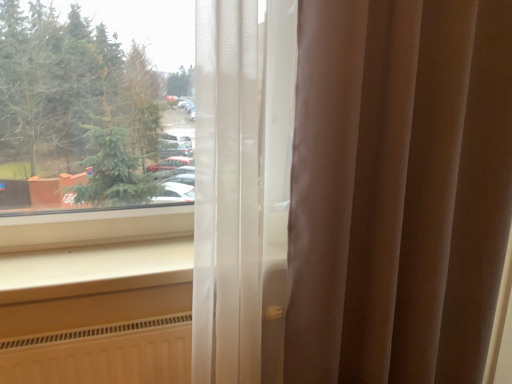
Question: Considering the positions of sheer white curtain at center and white smooth window sill at lower left in the image, is sheer white curtain at center taller or shorter than white smooth window sill at lower left?

Choices:
 (A) short
 (B) tall

Answer: (B)

Question: From the image's perspective, is sheer white curtain at center positioned above or below white smooth window sill at lower left?

Choices:
 (A) below
 (B) above

Answer: (B)

Question: Do you think sheer white curtain at center is within white smooth window sill at lower left, or outside of it?

Choices:
 (A) inside
 (B) outside

Answer: (B)

Question: In terms of width, does white smooth window sill at lower left look wider or thinner when compared to sheer white curtain at center?

Choices:
 (A) wide
 (B) thin

Answer: (A)

Question: Which is correct: white smooth window sill at lower left is inside sheer white curtain at center, or outside of it?

Choices:
 (A) inside
 (B) outside

Answer: (B)

Question: Considering the positions of white smooth window sill at lower left and sheer white curtain at center in the image, is white smooth window sill at lower left taller or shorter than sheer white curtain at center?

Choices:
 (A) short
 (B) tall

Answer: (A)

Question: From the image's perspective, is white smooth window sill at lower left located above or below sheer white curtain at center?

Choices:
 (A) below
 (B) above

Answer: (A)